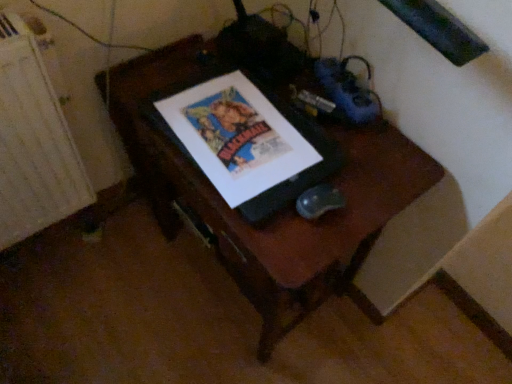
You are a GUI agent. You are given a task and a screenshot of the screen. Output one action in this format:
    pyautogui.click(x=<x>, y=<y>)
    Task: Click on the free space above matte paper poster at center (from a real-world perspective)
    The height and width of the screenshot is (384, 512).
    Given the screenshot: What is the action you would take?
    pyautogui.click(x=244, y=123)